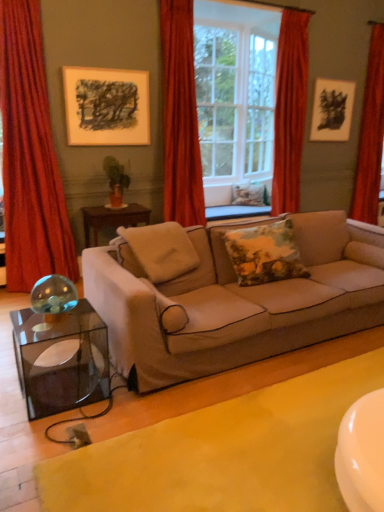
This screenshot has width=384, height=512. I want to click on blank area beneath transparent glass table at lower left (from a real-world perspective), so click(66, 390).